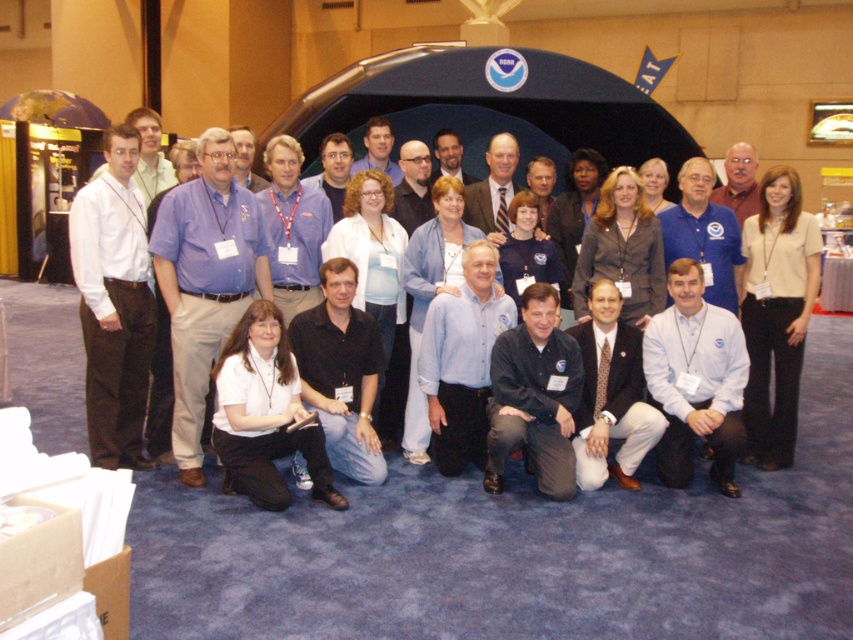
Question: Which object appears closest to the camera in this image?

Choices:
 (A) white cotton shirt at left
 (B) beige fabric shirt at center
 (C) white fabric shirt at lower center

Answer: (A)

Question: Which of the following is the farthest from the observer?

Choices:
 (A) (103, 456)
 (B) (790, 257)
 (C) (160, 252)

Answer: (B)

Question: From the image, what is the correct spatial relationship of white cotton shirt at left in relation to white shirt at center?

Choices:
 (A) right
 (B) left

Answer: (B)

Question: Does beige fabric shirt at center lie in front of white shirt at center?

Choices:
 (A) no
 (B) yes

Answer: (A)

Question: Which point appears farthest from the camera in this image?

Choices:
 (A) (248, 221)
 (B) (491, 161)
 (C) (112, 316)

Answer: (B)

Question: Is beige fabric shirt at center to the left of white shirt at center from the viewer's perspective?

Choices:
 (A) yes
 (B) no

Answer: (B)